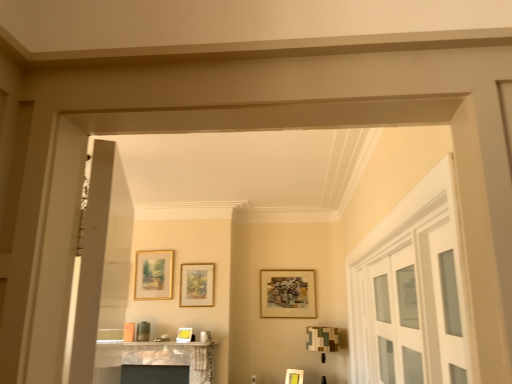
Question: Looking at the image, does clear glass cabinet at right seem bigger or smaller compared to wooden picture frame at center, the fourth picture frame in the left-to-right sequence?

Choices:
 (A) big
 (B) small

Answer: (A)

Question: In the image, is clear glass cabinet at right positioned in front of or behind wooden picture frame at center, the second picture frame from the right?

Choices:
 (A) behind
 (B) front

Answer: (B)

Question: Which object is positioned closest to the matte gold picture frame at upper left, the 1th picture frame positioned from the left?

Choices:
 (A) white glass door at right
 (B) matte gold picture frame at center, which is the second picture frame from left to right
 (C) camouflage fabric lampshade at right
 (D) matte gold picture frame at center, the third picture frame from the right
 (E) matte gold picture frame at center, which ranks as the fifth picture frame in left-to-right order

Answer: (D)

Question: Which object is positioned farthest from the white glass door at right?

Choices:
 (A) clear glass cabinet at right
 (B) camouflage fabric lampshade at right
 (C) matte gold picture frame at center, which is the second picture frame from left to right
 (D) wooden picture frame at center, the fourth picture frame in the left-to-right sequence
 (E) marble fireplace at lower center

Answer: (C)